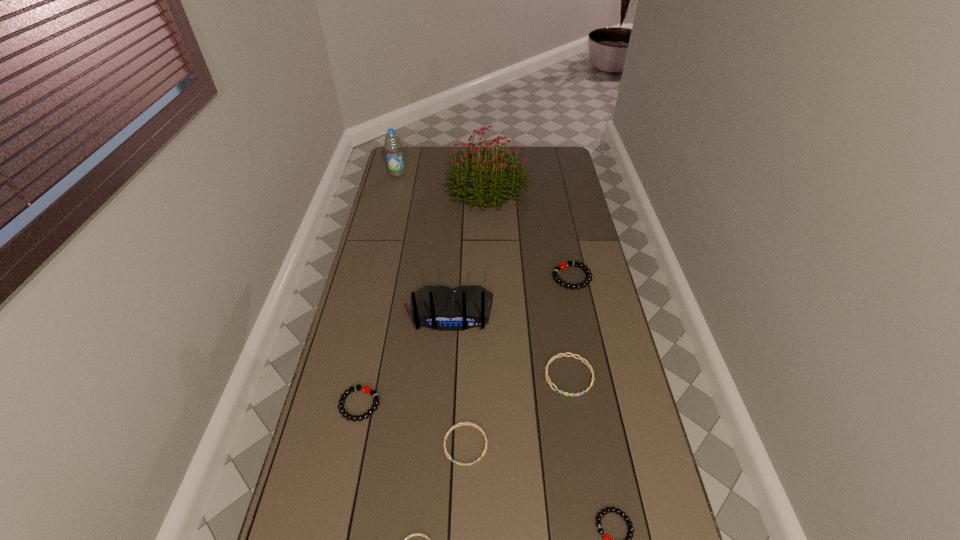
Locate an element on the screen. This screenshot has width=960, height=540. blue bracelet that is the second closest to the bouquet is located at coordinates (464, 423).